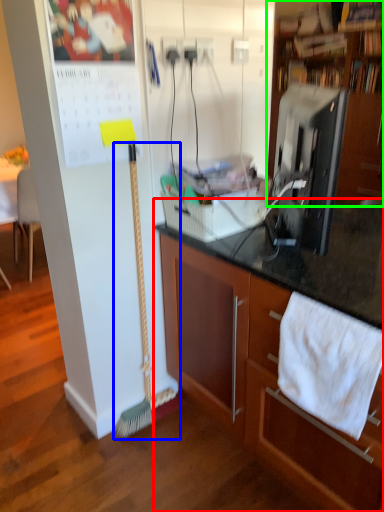
Question: Which object is positioned farthest from cabinetry (highlighted by a red box)? Select from brush (highlighted by a blue box) and cabinetry (highlighted by a green box).

Choices:
 (A) brush
 (B) cabinetry

Answer: (B)